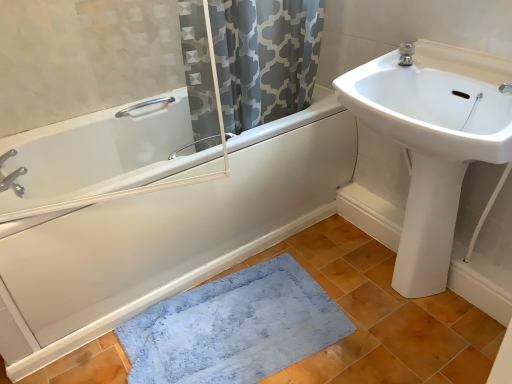
Question: Would you say blue plush bath mat at lower center is to the left or to the right of white glossy sink at upper right in the picture?

Choices:
 (A) right
 (B) left

Answer: (B)

Question: Considering the positions of point click(x=181, y=304) and point click(x=437, y=119), is point click(x=181, y=304) closer or farther from the camera than point click(x=437, y=119)?

Choices:
 (A) farther
 (B) closer

Answer: (A)

Question: Considering the real-world distances, which object is closest to the blue plush bath mat at lower center?

Choices:
 (A) white glossy bathtub at left
 (B) white glossy sink at upper right
 (C) gray printed fabric at upper center
 (D) satin nickel faucet at upper right, acting as the first tap starting from the top
 (E) white glossy bathtub at left

Answer: (E)

Question: Based on their relative distances, which object is nearer to the blue plush bath mat at lower center?

Choices:
 (A) satin nickel faucet at upper right, acting as the first tap starting from the top
 (B) white glossy bidet at right
 (C) white glossy sink at upper right
 (D) brushed metal faucet at upper left, the 2th tap in the right-to-left sequence
 (E) white glossy bathtub at left

Answer: (B)